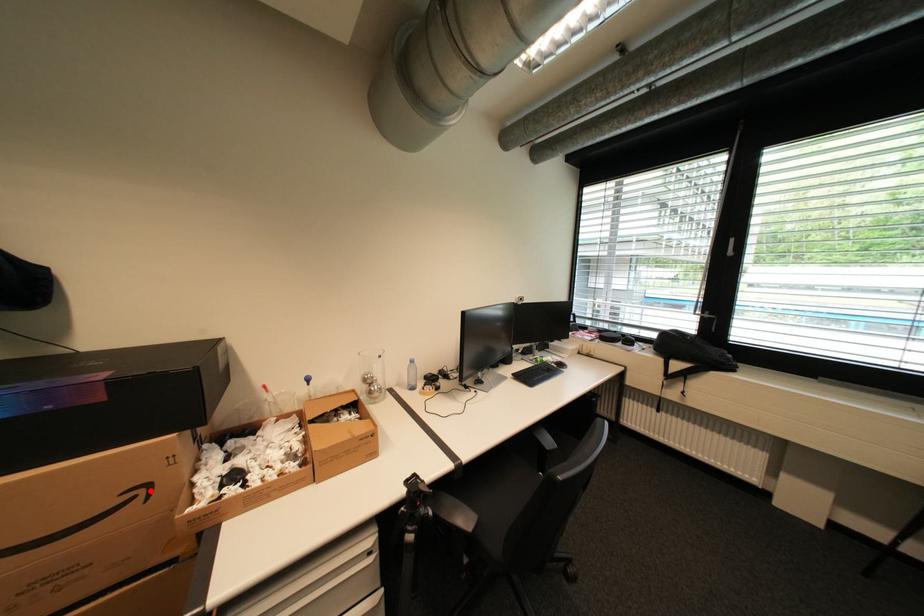
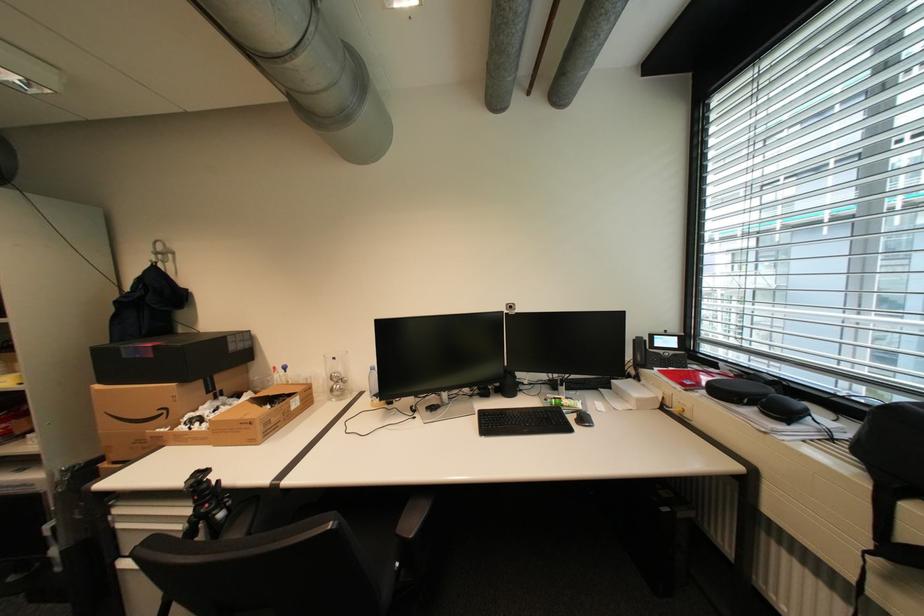
The point at the highlighted location is marked in the first image. Where is the corresponding point in the second image?

(174, 411)